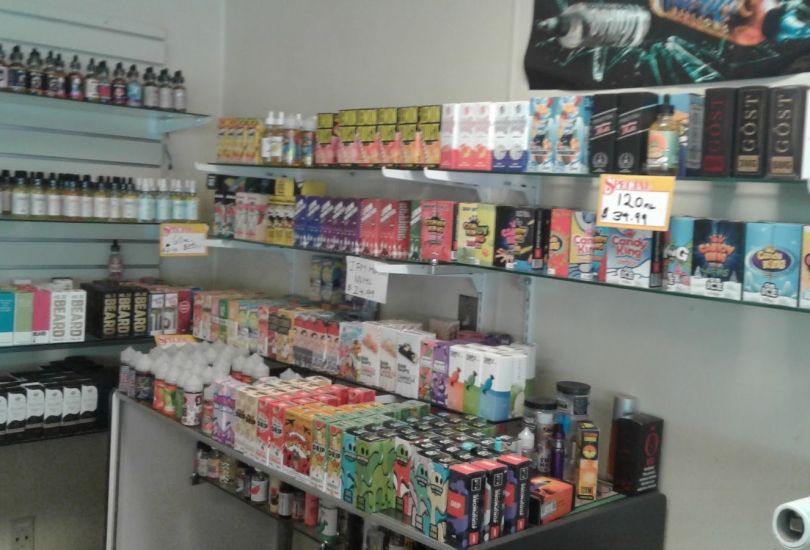
Locate an element on the screen. The image size is (810, 550). poster is located at coordinates (518, 296), (633, 64).